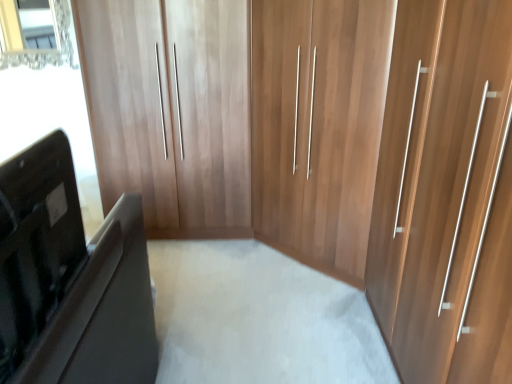
This screenshot has width=512, height=384. I want to click on free space above matte black laptop at left (from a real-world perspective), so click(x=33, y=152).